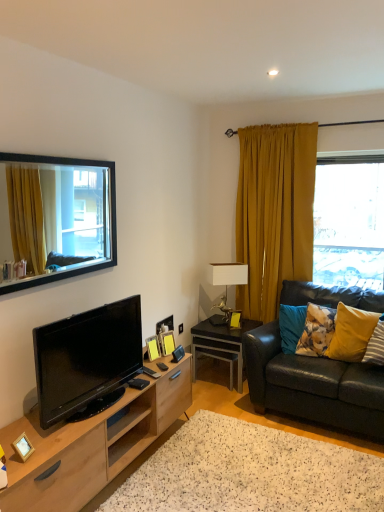
This screenshot has height=512, width=384. What are the coordinates of `free spot in front of wooden picture frame at center, positioned as the third picture frame in front-to-back order` in the screenshot? It's located at (167, 360).